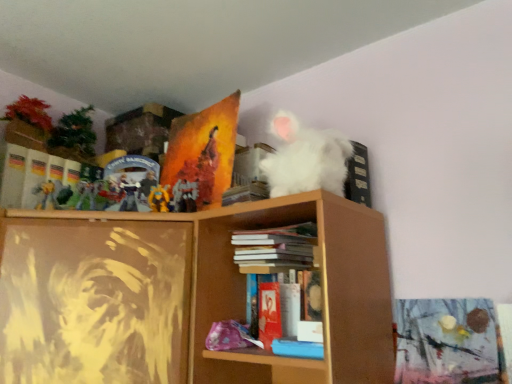
Question: Is metallic gold action figure at upper center oriented towards blue matte book at lower center, the 1th book positioned from the bottom?

Choices:
 (A) no
 (B) yes

Answer: (A)

Question: Can you confirm if metallic gold action figure at upper center is shorter than blue matte book at lower center, acting as the 1th book starting from the front?

Choices:
 (A) yes
 (B) no

Answer: (B)

Question: From a real-world perspective, does metallic gold action figure at upper center stand above blue matte book at lower center, the second book viewed from the back?

Choices:
 (A) yes
 (B) no

Answer: (A)

Question: Does metallic gold action figure at upper center appear on the left side of blue matte book at lower center, the 1th book positioned from the bottom?

Choices:
 (A) yes
 (B) no

Answer: (A)

Question: Is metallic gold action figure at upper center bigger than blue matte book at lower center, which appears as the 2th book when viewed from the top?

Choices:
 (A) no
 (B) yes

Answer: (A)

Question: Is point (147, 195) positioned closer to the camera than point (269, 296)?

Choices:
 (A) farther
 (B) closer

Answer: (A)

Question: From the image's perspective, relative to matte red paperback book at center, which is the second paperback book in top-to-bottom order, is metallic gold action figure at upper center above or below?

Choices:
 (A) above
 (B) below

Answer: (A)

Question: Considering the positions of metallic gold action figure at upper center and matte red paperback book at center, the second paperback book viewed from the left, in the image, is metallic gold action figure at upper center wider or thinner than matte red paperback book at center, the second paperback book viewed from the left,?

Choices:
 (A) thin
 (B) wide

Answer: (A)

Question: From a real-world perspective, is metallic gold action figure at upper center above or below matte red paperback book at center, the first paperback book from the right?

Choices:
 (A) above
 (B) below

Answer: (A)

Question: In terms of size, does metallic gold action figure at upper center appear bigger or smaller than blue matte book at lower center, acting as the 1th book starting from the front?

Choices:
 (A) small
 (B) big

Answer: (A)

Question: Is point (158, 208) positioned closer to the camera than point (321, 349)?

Choices:
 (A) farther
 (B) closer

Answer: (A)

Question: Visually, is metallic gold action figure at upper center positioned to the left or to the right of blue matte book at lower center, the 1th book positioned from the bottom?

Choices:
 (A) left
 (B) right

Answer: (A)

Question: Which is correct: metallic gold action figure at upper center is inside blue matte book at lower center, the 1th book positioned from the bottom, or outside of it?

Choices:
 (A) outside
 (B) inside

Answer: (A)

Question: Based on their positions, is hardcover book at center, the second book ordered from the bottom, located to the left or right of matte red paperback book at center, which is the second paperback book in top-to-bottom order?

Choices:
 (A) right
 (B) left

Answer: (A)

Question: Considering the positions of hardcover book at center, which appears as the first book when viewed from the back, and matte red paperback book at center, the 1th paperback book positioned from the bottom, in the image, is hardcover book at center, which appears as the first book when viewed from the back, wider or thinner than matte red paperback book at center, the 1th paperback book positioned from the bottom,?

Choices:
 (A) wide
 (B) thin

Answer: (A)